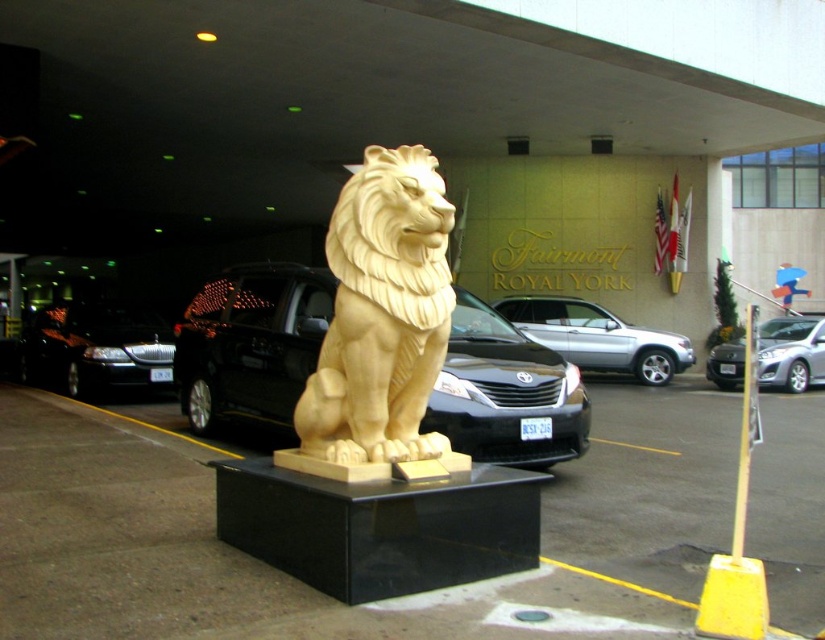
Does satin black car at center have a smaller size compared to satin silver sedan at center?

Indeed, satin black car at center has a smaller size compared to satin silver sedan at center.

Can you confirm if satin black car at center is positioned above satin silver sedan at center?

Incorrect, satin black car at center is not positioned above satin silver sedan at center.

Which is in front, point (244, 332) or point (812, 348)?

Positioned in front is point (244, 332).

I want to click on satin black car at center, so click(x=250, y=344).

Looking at this image, is shiny black sedan at left bigger than satin silver sedan at center?

Correct, shiny black sedan at left is larger in size than satin silver sedan at center.

Does shiny black sedan at left have a lesser width compared to satin silver sedan at center?

No, shiny black sedan at left is not thinner than satin silver sedan at center.

Describe the element at coordinates (95, 348) in the screenshot. The height and width of the screenshot is (640, 825). I see `shiny black sedan at left` at that location.

Locate an element on the screen. The width and height of the screenshot is (825, 640). shiny black sedan at left is located at coordinates (95, 348).

Does point (272, 392) lie in front of point (60, 380)?

That is True.

Is satin black car at center smaller than shiny black sedan at left?

Correct, satin black car at center occupies less space than shiny black sedan at left.

What do you see at coordinates (250, 344) in the screenshot? The image size is (825, 640). I see `satin black car at center` at bounding box center [250, 344].

This screenshot has height=640, width=825. In order to click on satin black car at center in this screenshot , I will do `click(250, 344)`.